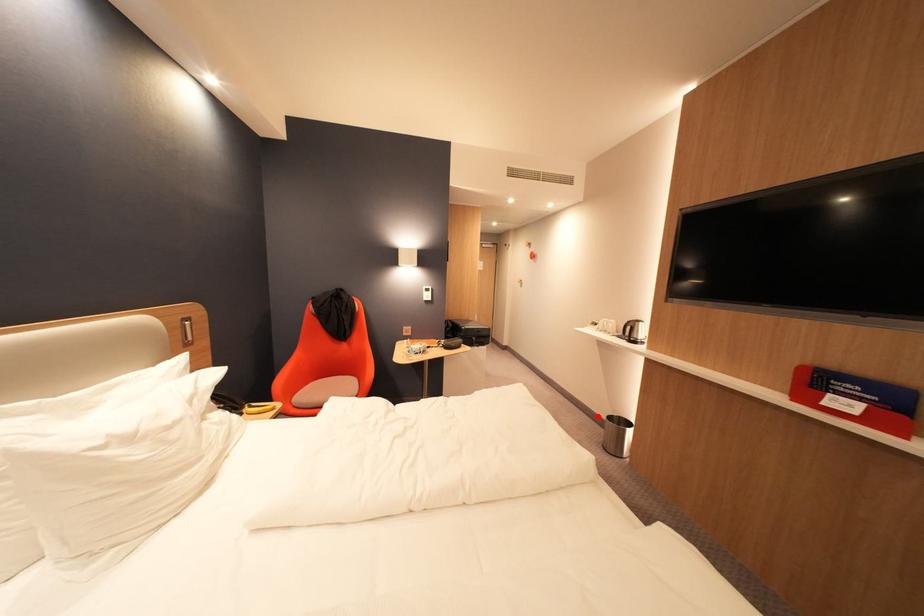
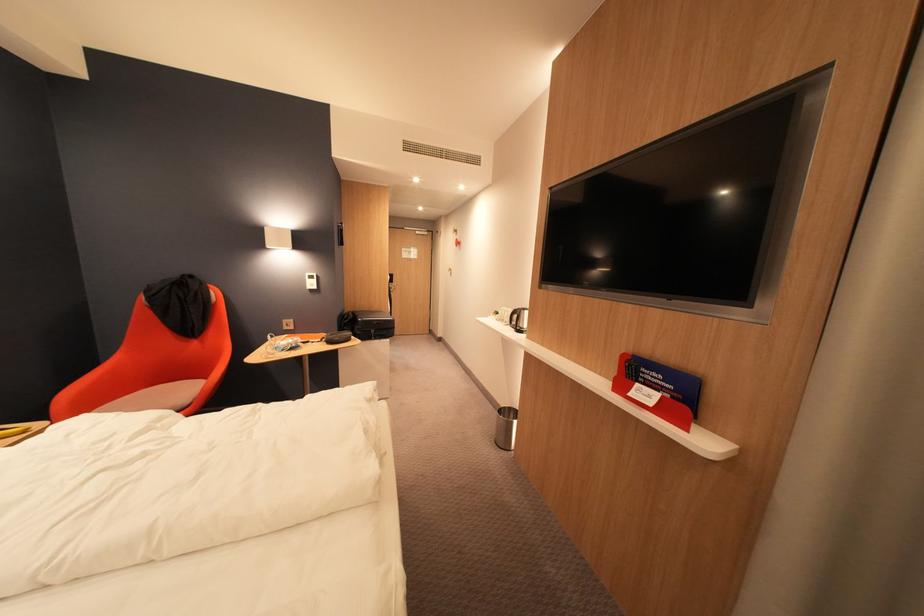
The point at the highlighted location is marked in the first image. Where is the corresponding point in the second image?

(504, 408)